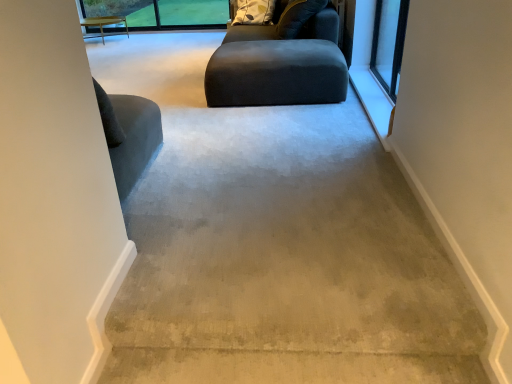
Question: From the image's perspective, is dark gray fabric bean bag at center on matte black ottoman at center?

Choices:
 (A) no
 (B) yes

Answer: (B)

Question: Is dark gray fabric bean bag at center facing away from matte black ottoman at center?

Choices:
 (A) no
 (B) yes

Answer: (A)

Question: Is dark gray fabric bean bag at center bigger than matte black ottoman at center?

Choices:
 (A) no
 (B) yes

Answer: (B)

Question: Considering the relative sizes of dark gray fabric bean bag at center and matte black ottoman at center in the image provided, is dark gray fabric bean bag at center wider than matte black ottoman at center?

Choices:
 (A) yes
 (B) no

Answer: (B)

Question: Does dark gray fabric bean bag at center have a smaller size compared to matte black ottoman at center?

Choices:
 (A) no
 (B) yes

Answer: (A)

Question: From the image's perspective, is clear glass window at upper right positioned above or below light wood table at upper left?

Choices:
 (A) above
 (B) below

Answer: (B)

Question: From a real-world perspective, is clear glass window at upper right above or below light wood table at upper left?

Choices:
 (A) above
 (B) below

Answer: (A)

Question: Considering the positions of clear glass window at upper right and light wood table at upper left in the image, is clear glass window at upper right taller or shorter than light wood table at upper left?

Choices:
 (A) short
 (B) tall

Answer: (B)

Question: Considering the positions of clear glass window at upper right and light wood table at upper left in the image, is clear glass window at upper right wider or thinner than light wood table at upper left?

Choices:
 (A) wide
 (B) thin

Answer: (B)

Question: Is matte black ottoman at center situated inside patterned fabric pillow at upper center or outside?

Choices:
 (A) outside
 (B) inside

Answer: (A)

Question: In terms of height, does matte black ottoman at center look taller or shorter compared to patterned fabric pillow at upper center?

Choices:
 (A) short
 (B) tall

Answer: (B)

Question: Is matte black ottoman at center in front of or behind patterned fabric pillow at upper center in the image?

Choices:
 (A) behind
 (B) front

Answer: (B)

Question: From a real-world perspective, is matte black ottoman at center above or below patterned fabric pillow at upper center?

Choices:
 (A) below
 (B) above

Answer: (A)

Question: Is clear glass window at upper right inside the boundaries of dark gray fabric bean bag at center, or outside?

Choices:
 (A) inside
 (B) outside

Answer: (B)

Question: Considering the positions of point (392, 72) and point (300, 31), is point (392, 72) closer or farther from the camera than point (300, 31)?

Choices:
 (A) farther
 (B) closer

Answer: (B)